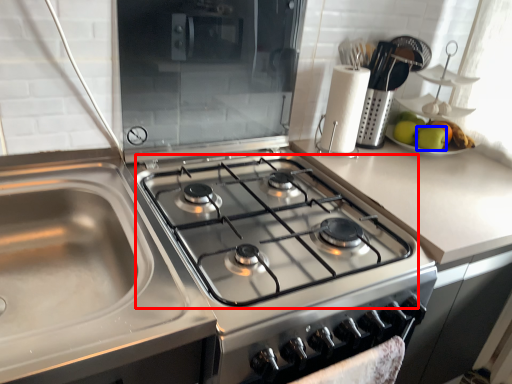
Question: Which of the following is the farthest to the observer, gas stove (highlighted by a red box) or apple (highlighted by a blue box)?

Choices:
 (A) gas stove
 (B) apple

Answer: (B)